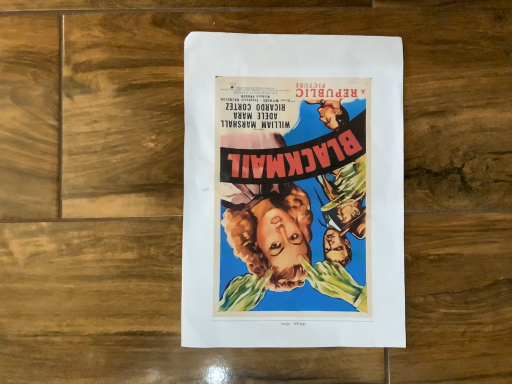
Where is `vibrant paper poster at center`? vibrant paper poster at center is located at coordinates (293, 191).

Describe the element at coordinates (293, 191) in the screenshot. The height and width of the screenshot is (384, 512). I see `vibrant paper poster at center` at that location.

Locate an element on the screen. The width and height of the screenshot is (512, 384). vibrant paper poster at center is located at coordinates (293, 191).